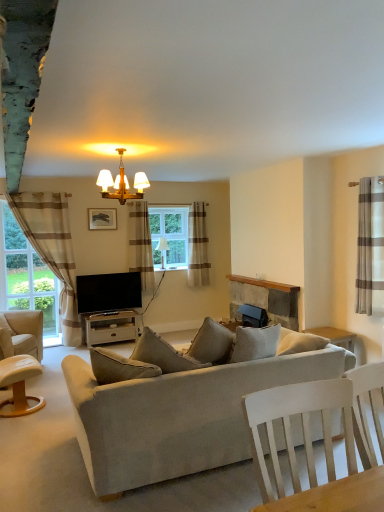
Where is `free location above matte gold chandelier at upper center, which is the first lamp in top-to-bottom order (from a real-world perspective)`? free location above matte gold chandelier at upper center, which is the first lamp in top-to-bottom order (from a real-world perspective) is located at coordinates (119, 150).